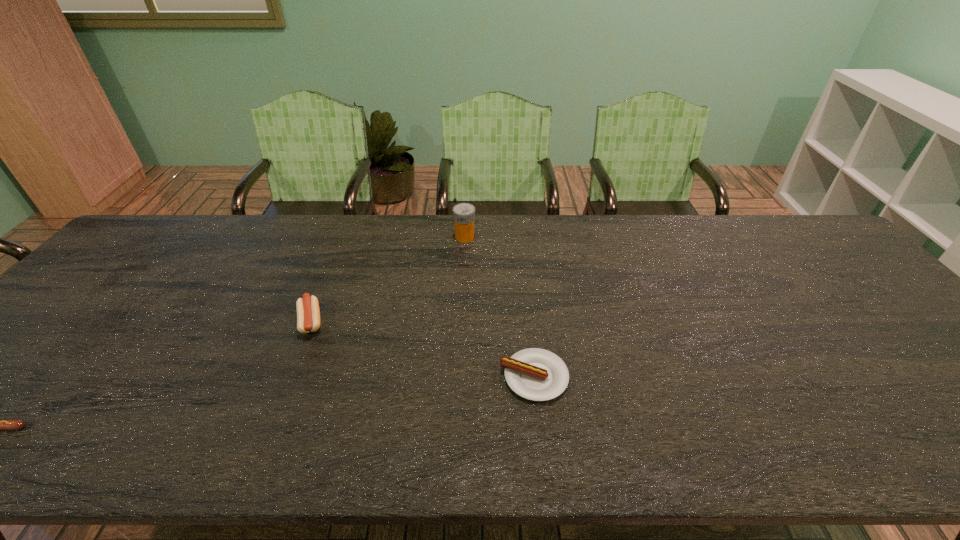
Identify the location of free space in the image that satisfies the following two spatial constraints: 1. on the label side of the medicine; 2. on the left side of the second shortest sausage. Image resolution: width=960 pixels, height=540 pixels. (459, 377).

Where is `vacant space that satisfies the following two spatial constraints: 1. on the front side of the second nearest object; 2. on the left side of the second sausage from left to right`? The height and width of the screenshot is (540, 960). vacant space that satisfies the following two spatial constraints: 1. on the front side of the second nearest object; 2. on the left side of the second sausage from left to right is located at coordinates (289, 377).